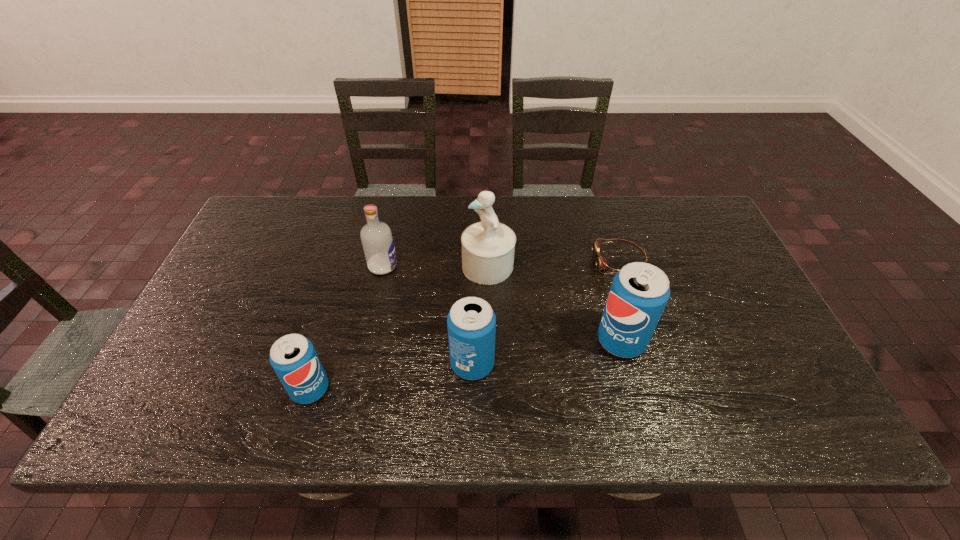
What are the coordinates of `the fifth tallest object` in the screenshot? It's located at (293, 357).

Identify the location of the leftmost object. (293, 357).

The image size is (960, 540). I want to click on the second shortest soda can, so click(471, 322).

At what (x,y) coordinates should I click in order to perform the action: click on the rightmost soda can. Please return your answer as a coordinate pair (x, y). This screenshot has width=960, height=540. Looking at the image, I should click on point(639,292).

Where is `the fifth object from right to left`? The height and width of the screenshot is (540, 960). the fifth object from right to left is located at coordinates (377, 240).

This screenshot has height=540, width=960. In order to click on figurine in this screenshot , I will do `click(488, 247)`.

This screenshot has width=960, height=540. What are the coordinates of `goggles` in the screenshot? It's located at (602, 263).

Find the location of a particular element. Image resolution: width=960 pixels, height=540 pixels. free space located on the right of the leftmost soda can is located at coordinates (440, 389).

The width and height of the screenshot is (960, 540). Identify the location of vacant area located on the left of the second soda can from right to left. (353, 364).

You are a GUI agent. You are given a task and a screenshot of the screen. Output one action in this format:
    pyautogui.click(x=<x>, y=<y>)
    Task: Click on the vacant space located on the left of the rightmost soda can
    The height and width of the screenshot is (540, 960).
    Given the screenshot: What is the action you would take?
    pyautogui.click(x=499, y=341)